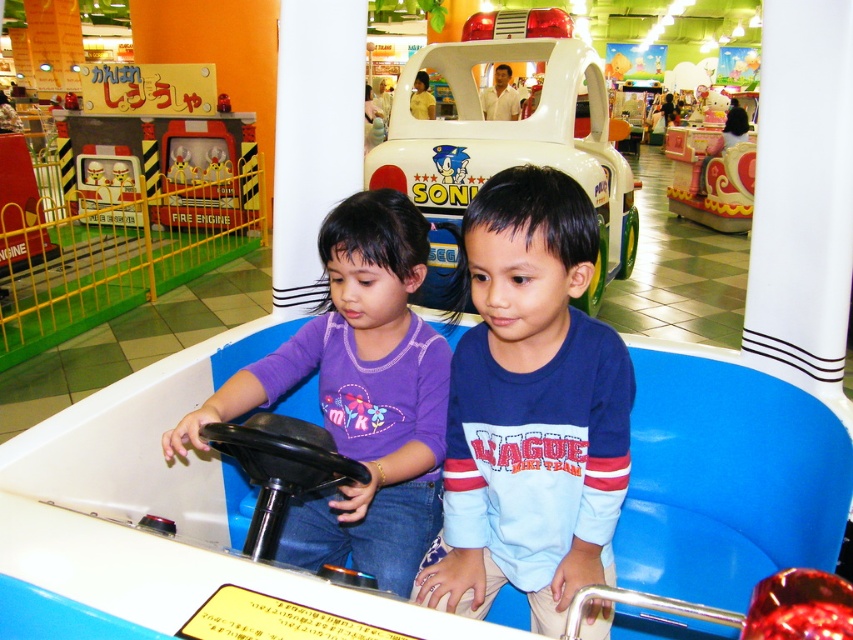
You are standing in the play area and want to reach a toy located at point [184,192]. There is an obstacle at point [418,177]. Which point is closer to you, the obstacle or the toy?

The obstacle at point [418,177] is closer to you than the toy at point [184,192].

You are a parent trying to take a photo of your child in the blue cotton shirt at center and the white plastic toy car at center. Which object should you focus on first to ensure both are in the frame?

You should focus on the white plastic toy car at center first because the blue cotton shirt at center is in front of it, so adjusting the camera to include the car behind will naturally include the shirt in front as well.